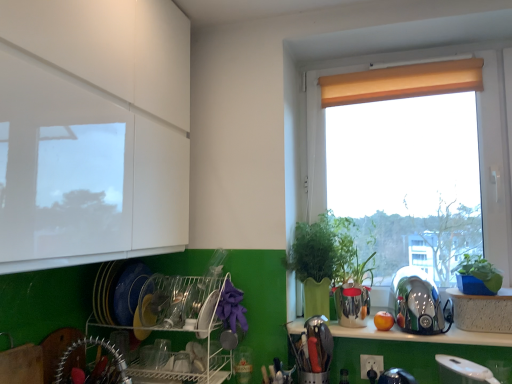
The height and width of the screenshot is (384, 512). I want to click on empty space that is ontop of beige fabric curtain at upper right (from a real-world perspective), so click(x=386, y=68).